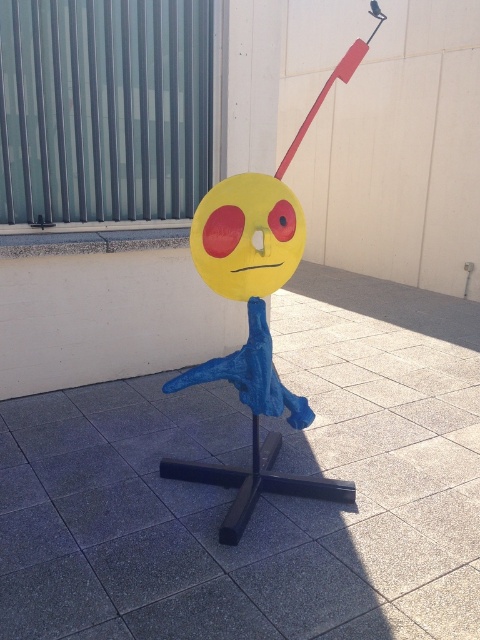
Question: Does yellow matte face at center appear on the left side of yellow paper face at center?

Choices:
 (A) yes
 (B) no

Answer: (B)

Question: Does yellow matte face at center appear on the left side of yellow matte sphere at center?

Choices:
 (A) yes
 (B) no

Answer: (B)

Question: Which of the following is the farthest from the observer?

Choices:
 (A) yellow matte sphere at center
 (B) yellow paper face at center

Answer: (B)

Question: Considering the real-world distances, which object is farthest from the yellow paper face at center?

Choices:
 (A) yellow matte face at center
 (B) yellow matte sphere at center

Answer: (A)

Question: Which object appears farthest from the camera in this image?

Choices:
 (A) yellow matte face at center
 (B) yellow paper face at center

Answer: (A)

Question: Is yellow matte face at center to the right of yellow matte sphere at center from the viewer's perspective?

Choices:
 (A) yes
 (B) no

Answer: (A)